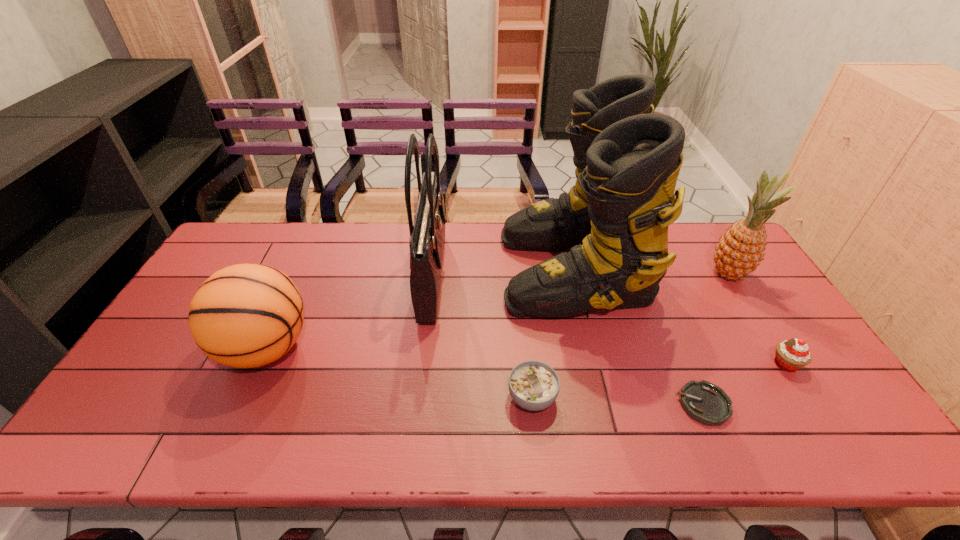
Identify the location of ashtray positioned at the near edge. 706,403.

You are a GUI agent. You are given a task and a screenshot of the screen. Output one action in this format:
    pyautogui.click(x=<x>, y=<y>)
    Task: Click on the pineapple that is positioned at the right edge
    
    Given the screenshot: What is the action you would take?
    pyautogui.click(x=741, y=249)

Find the location of a particular element. The image size is (960, 540). cupcake present at the right edge is located at coordinates (791, 355).

I want to click on object located at the far right corner, so click(741, 249).

This screenshot has height=540, width=960. I want to click on free region at the far edge, so click(485, 245).

This screenshot has height=540, width=960. I want to click on free spot at the near edge of the desktop, so click(x=189, y=421).

The width and height of the screenshot is (960, 540). In order to click on free region at the left edge in this screenshot , I will do `click(161, 407)`.

At what (x,y) coordinates should I click in order to perform the action: click on vacant space at the right edge of the desktop. Please return your answer as a coordinate pair (x, y). This screenshot has height=540, width=960. Looking at the image, I should click on (766, 332).

In the image, there is a desktop. Where is `free space at the far left corner`? The image size is (960, 540). free space at the far left corner is located at coordinates (234, 233).

The width and height of the screenshot is (960, 540). Find the location of `free point at the far right corner`. free point at the far right corner is located at coordinates (x=701, y=253).